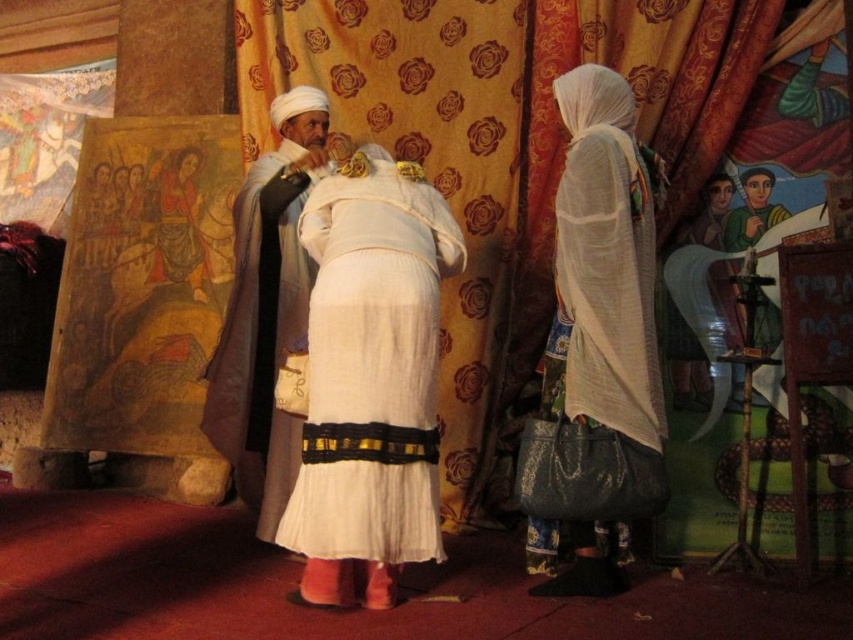
Does matte white robe at center lie behind green fabric figure at upper right?

Yes.

Can you confirm if matte white robe at center is smaller than green fabric figure at upper right?

Actually, matte white robe at center might be larger than green fabric figure at upper right.

This screenshot has width=853, height=640. What are the coordinates of `matte white robe at center` in the screenshot? It's located at pyautogui.click(x=178, y=225).

The width and height of the screenshot is (853, 640). In order to click on matte white robe at center in this screenshot , I will do `click(178, 225)`.

Between white sheer fabric at center and white silk robe at center, which one has less height?

white sheer fabric at center

I want to click on white sheer fabric at center, so click(605, 264).

This screenshot has height=640, width=853. Find the location of `white sheer fabric at center`. white sheer fabric at center is located at coordinates (605, 264).

Where is `white sheer fabric at center`? white sheer fabric at center is located at coordinates (605, 264).

Does yellow floral fabric at center come in front of white cotton dress at center?

No.

Is the position of yellow floral fabric at center more distant than that of white cotton dress at center?

That is True.

The width and height of the screenshot is (853, 640). What do you see at coordinates (502, 147) in the screenshot?
I see `yellow floral fabric at center` at bounding box center [502, 147].

Find the location of a particular element. The image size is (853, 640). yellow floral fabric at center is located at coordinates (502, 147).